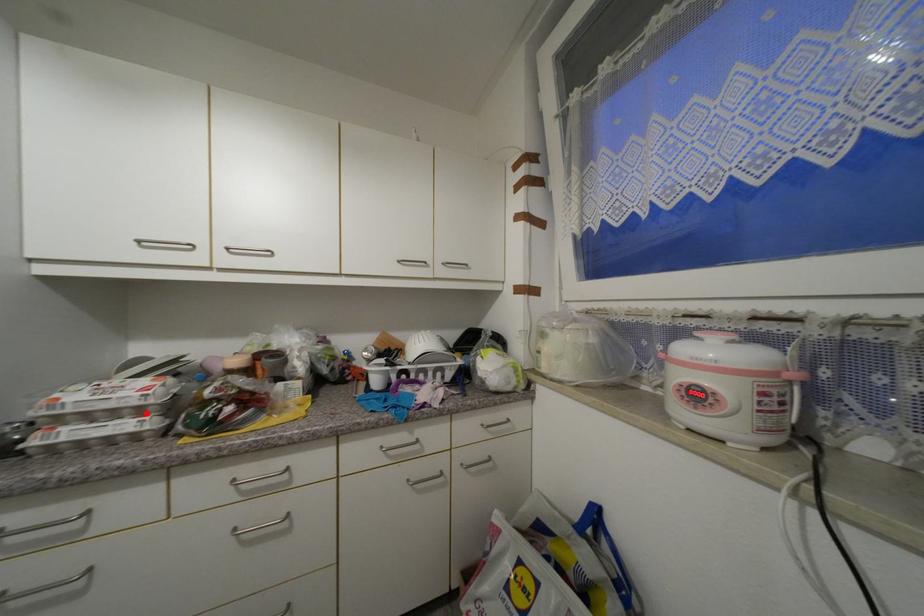
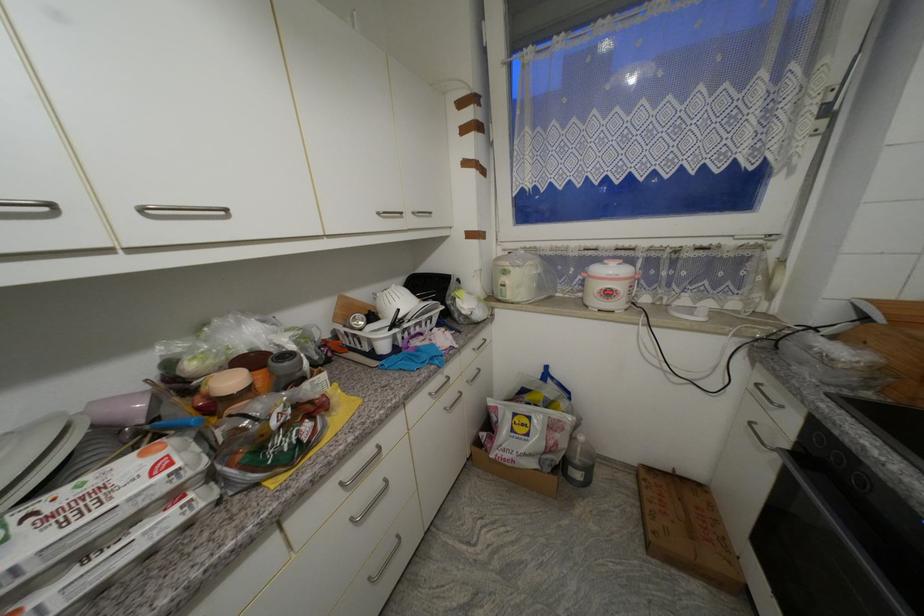
Find the pixel in the second image that matches the highlighted location in the first image.

(178, 498)